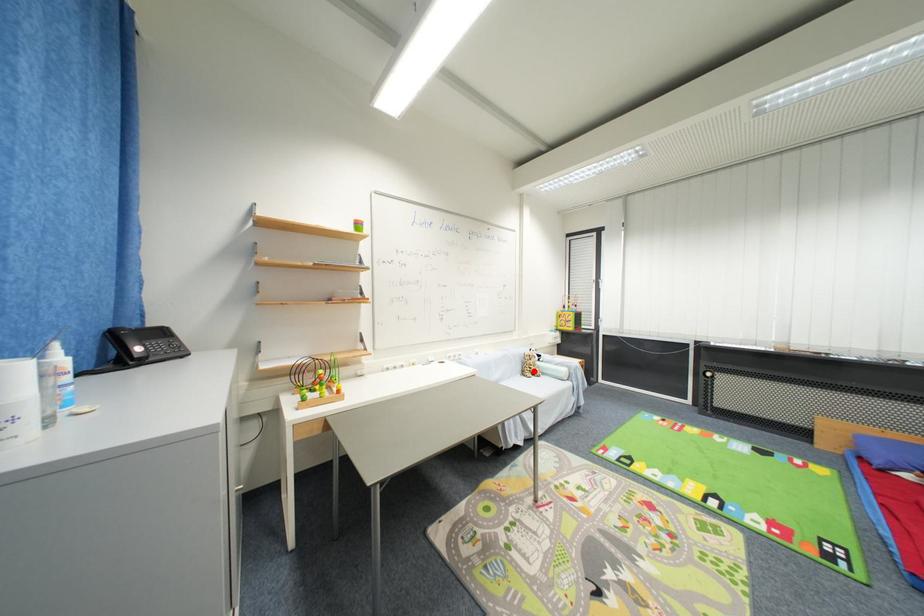
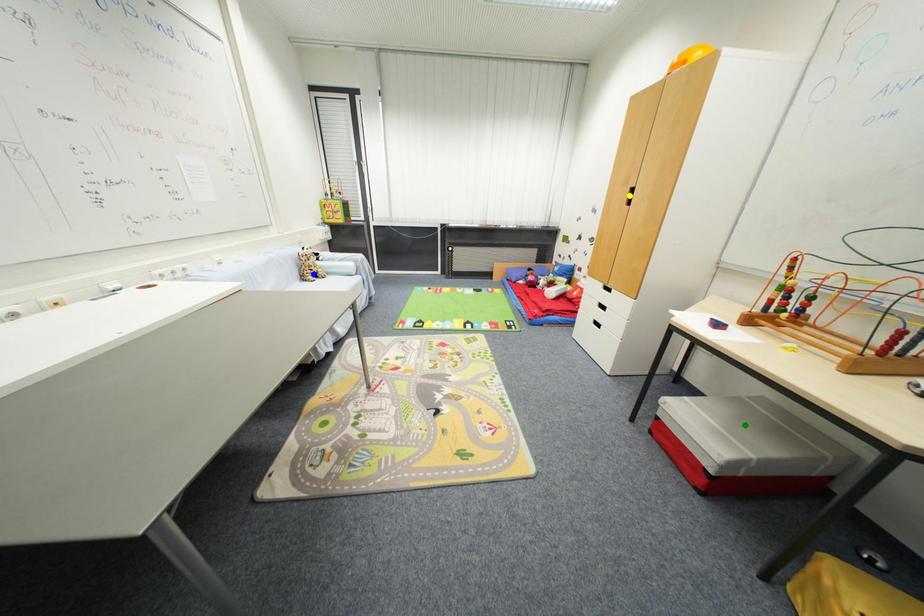
Question: I am providing you with two images of the same scene from different viewpoints. A red point is marked on the first image. You are given multiple points on the second image. Which mark in image 2 goes with the point in image 1?

Choices:
 (A) yellow point
 (B) blue point
 (C) green point

Answer: (B)